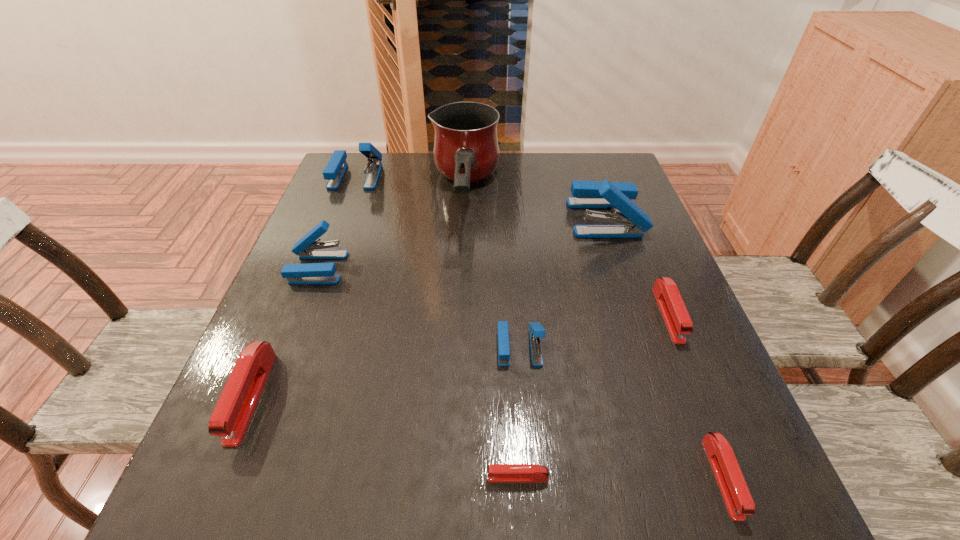
Locate an element on the screen. The image size is (960, 540). vacant area that lies between the saucepan and the farthest stapler is located at coordinates (x=410, y=187).

Identify the location of vacant space that's between the third red stapler from right to left and the farthest stapler. point(437,327).

I want to click on unoccupied position between the eighth tallest object and the second red stapler from left to right, so click(x=620, y=477).

The image size is (960, 540). I want to click on free space between the smallest blue stapler and the seventh shortest stapler, so click(x=438, y=261).

Point out which object is positioned as the second nearest to the farthest blue stapler. Please provide its 2D coordinates. Your answer should be formatted as a tuple, i.e. [(x, y)], where the tuple contains the x and y coordinates of a point satisfying the conditions above.

[(307, 247)]

Select which object appears as the seventh closest to the second shortest object. Please provide its 2D coordinates. Your answer should be formatted as a tuple, i.e. [(x, y)], where the tuple contains the x and y coordinates of a point satisfying the conditions above.

[(307, 247)]

Identify which stapler is located as the sixth nearest to the nearest blue stapler. Please provide its 2D coordinates. Your answer should be formatted as a tuple, i.e. [(x, y)], where the tuple contains the x and y coordinates of a point satisfying the conditions above.

[(235, 407)]

You are a GUI agent. You are given a task and a screenshot of the screen. Output one action in this format:
    pyautogui.click(x=<x>, y=<y>)
    Task: Click on the stapler identified as the closest to the third shortest object
    This screenshot has width=960, height=540.
    Given the screenshot: What is the action you would take?
    pyautogui.click(x=586, y=194)

Locate an element on the screen. blue stapler that is the second closest to the leftmost red stapler is located at coordinates (536, 331).

Locate which blue stapler ranks second in proximity to the second smallest blue stapler. Please provide its 2D coordinates. Your answer should be formatted as a tuple, i.e. [(x, y)], where the tuple contains the x and y coordinates of a point satisfying the conditions above.

[(536, 331)]